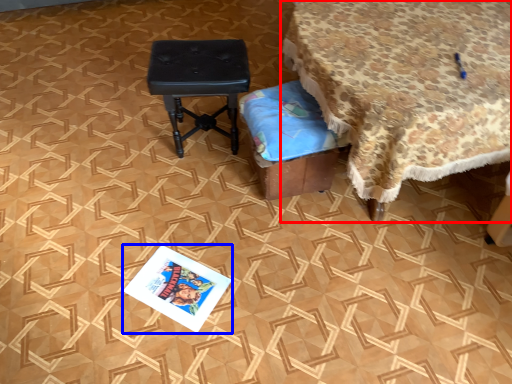
Question: Which object appears farthest to the camera in this image, table (highlighted by a red box) or magazine (highlighted by a blue box)?

Choices:
 (A) table
 (B) magazine

Answer: (B)